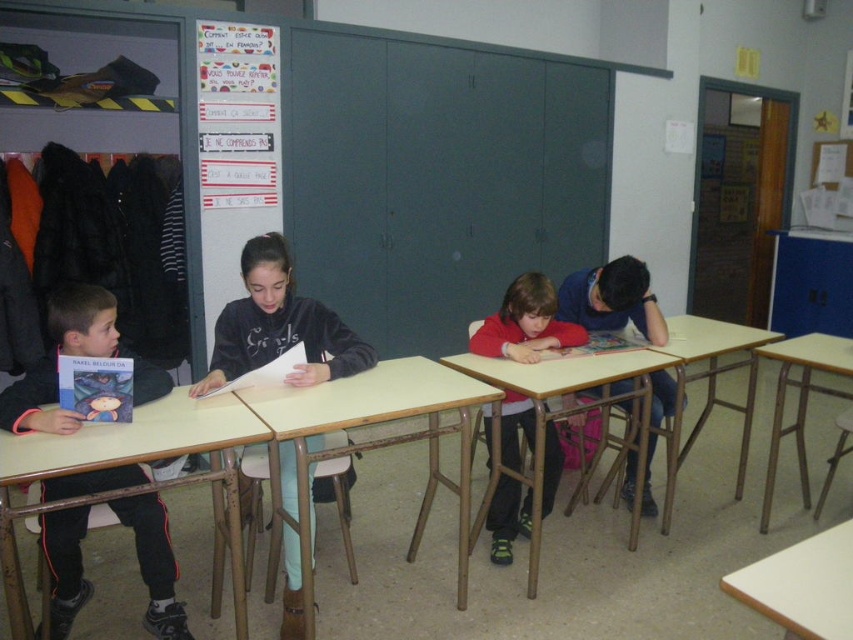
Question: Which of the following is the closest to the observer?

Choices:
 (A) light brown wooden table at center
 (B) wooden at right
 (C) red matte sweater at center

Answer: (A)

Question: Which is farther from the red matte sweater at center?

Choices:
 (A) wooden table at lower right
 (B) wooden desk at center

Answer: (A)

Question: Is wooden desk at left positioned at the back of blue cotton shirt at center?

Choices:
 (A) no
 (B) yes

Answer: (A)

Question: Is blue cotton shirt at center thinner than wooden at right?

Choices:
 (A) yes
 (B) no

Answer: (A)

Question: Can you confirm if wooden desk at center is smaller than wooden table at lower right?

Choices:
 (A) yes
 (B) no

Answer: (A)

Question: Which of the following is the closest to the observer?

Choices:
 (A) (628, 404)
 (B) (793, 380)
 (C) (471, 336)
 (D) (20, 444)

Answer: (D)